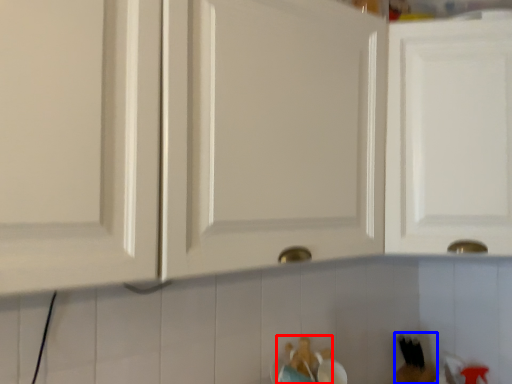
Question: Which object is further to the camera taking this photo, toy (highlighted by a red box) or toy (highlighted by a blue box)?

Choices:
 (A) toy
 (B) toy

Answer: (B)